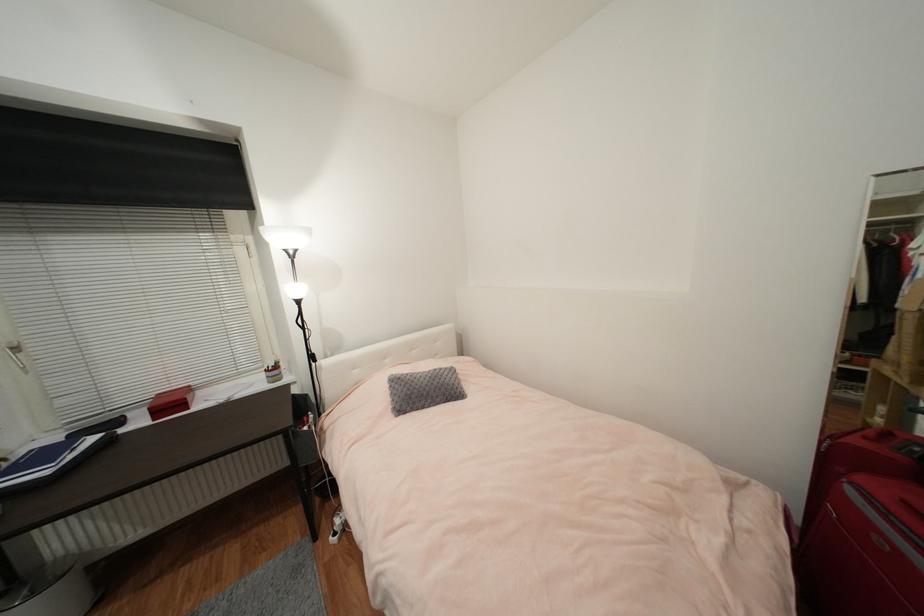
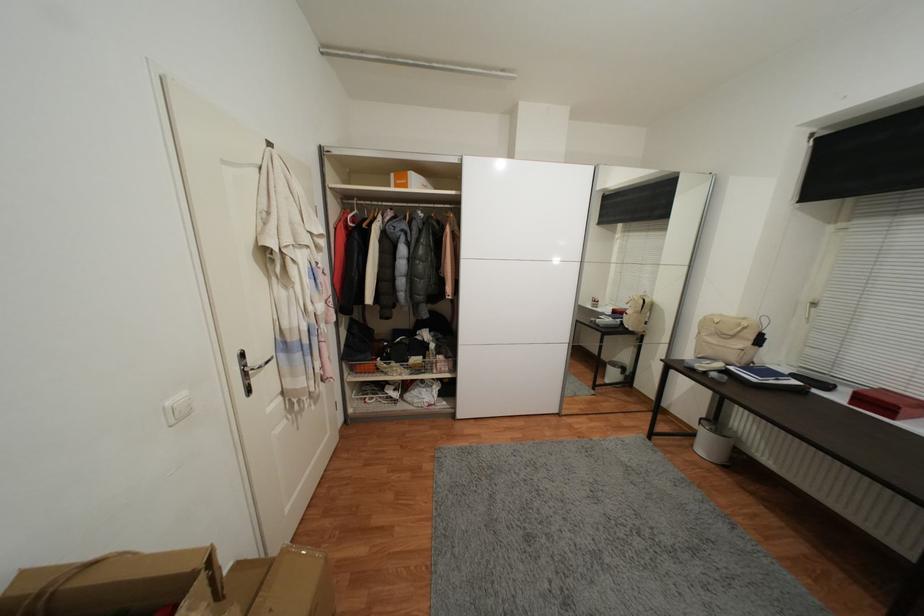
Question: I am providing you with two images of the same scene from different viewpoints. Which of the following objects are not visible in image2?

Choices:
 (A) large cardboard box
 (B) white light switch
 (C) wire basket
 (D) none of these

Answer: (D)